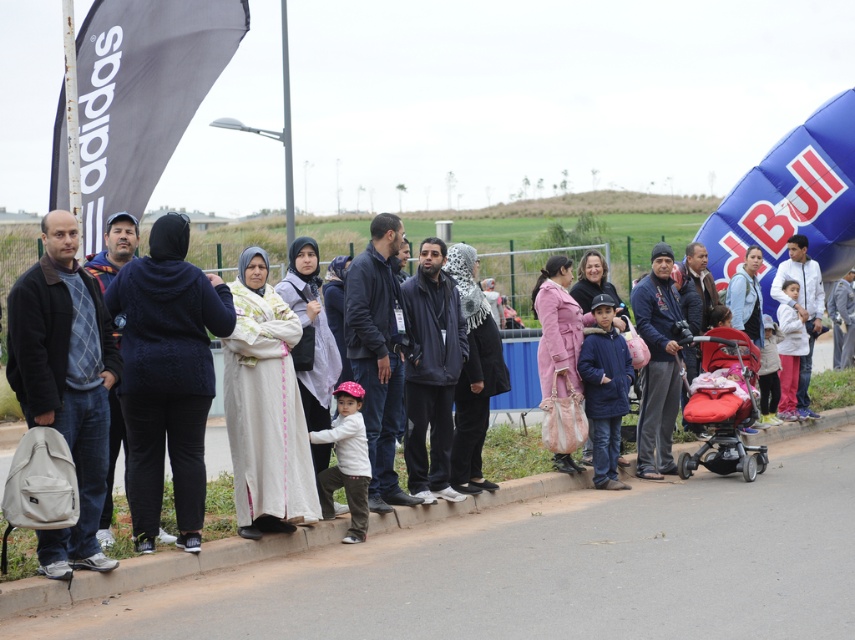
Based on the photo, you are a photographer trying to capture a photo of the dark blue fleece at center and the matte red baby carriage at right. Which object should you focus on first if you want to ensure both are in the frame without moving the camera?

The dark blue fleece at center is much taller than the matte red baby carriage at right, so you should focus on the dark blue fleece at center first to ensure it fits within the frame.